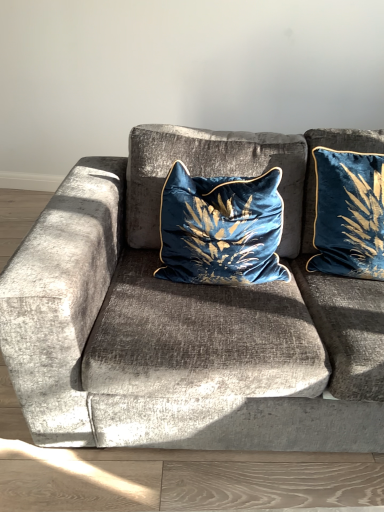
Question: Could you tell me if velvet blue pillow at upper right, which is the first pillow from right to left, is facing velvet blue pillow at center, which ranks as the 1th pillow in left-to-right order?

Choices:
 (A) no
 (B) yes

Answer: (A)

Question: Does velvet blue pillow at upper right, which appears as the 2th pillow when viewed from the left, have a larger size compared to velvet blue pillow at center, which ranks as the 1th pillow in left-to-right order?

Choices:
 (A) yes
 (B) no

Answer: (B)

Question: Can you see velvet blue pillow at upper right, which is the first pillow from right to left, touching velvet blue pillow at center, the 2th pillow from the right?

Choices:
 (A) no
 (B) yes

Answer: (A)

Question: From a real-world perspective, is velvet blue pillow at upper right, which appears as the 2th pillow when viewed from the left, positioned under velvet blue pillow at center, the 2th pillow from the right, based on gravity?

Choices:
 (A) yes
 (B) no

Answer: (B)

Question: Is velvet blue pillow at upper right, which is the first pillow from right to left, further to the viewer compared to velvet blue pillow at center, the 2th pillow from the right?

Choices:
 (A) no
 (B) yes

Answer: (B)

Question: Does velvet blue pillow at upper right, which is the first pillow from right to left, have a lesser height compared to velvet blue pillow at center, the 2th pillow from the right?

Choices:
 (A) yes
 (B) no

Answer: (B)

Question: From a real-world perspective, is velvet blue pillow at upper right, which is the first pillow from right to left, over velvet cushion at center?

Choices:
 (A) yes
 (B) no

Answer: (A)

Question: Is velvet blue pillow at upper right, which is the first pillow from right to left, positioned with its back to velvet cushion at center?

Choices:
 (A) no
 (B) yes

Answer: (B)

Question: Is velvet blue pillow at upper right, which is the first pillow from right to left, behind velvet cushion at center?

Choices:
 (A) no
 (B) yes

Answer: (B)

Question: Does velvet blue pillow at upper right, which is the first pillow from right to left, contain velvet cushion at center?

Choices:
 (A) no
 (B) yes

Answer: (A)

Question: From a real-world perspective, is velvet blue pillow at upper right, which appears as the 2th pillow when viewed from the left, below velvet cushion at center?

Choices:
 (A) no
 (B) yes

Answer: (A)

Question: Can you confirm if velvet blue pillow at upper right, which is the first pillow from right to left, is bigger than velvet cushion at center?

Choices:
 (A) yes
 (B) no

Answer: (B)

Question: Is velvet blue pillow at center, the 2th pillow from the right, to the left of velvet blue pillow at upper right, which appears as the 2th pillow when viewed from the left, from the viewer's perspective?

Choices:
 (A) no
 (B) yes

Answer: (B)